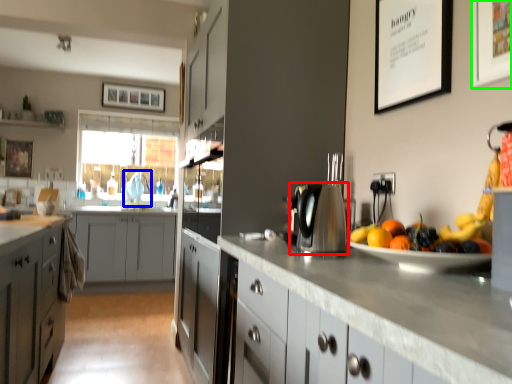
Question: Based on their relative distances, which object is nearer to kitchen appliance (highlighted by a red box)? Choose from faucet (highlighted by a blue box) and picture frame (highlighted by a green box).

Choices:
 (A) faucet
 (B) picture frame

Answer: (B)